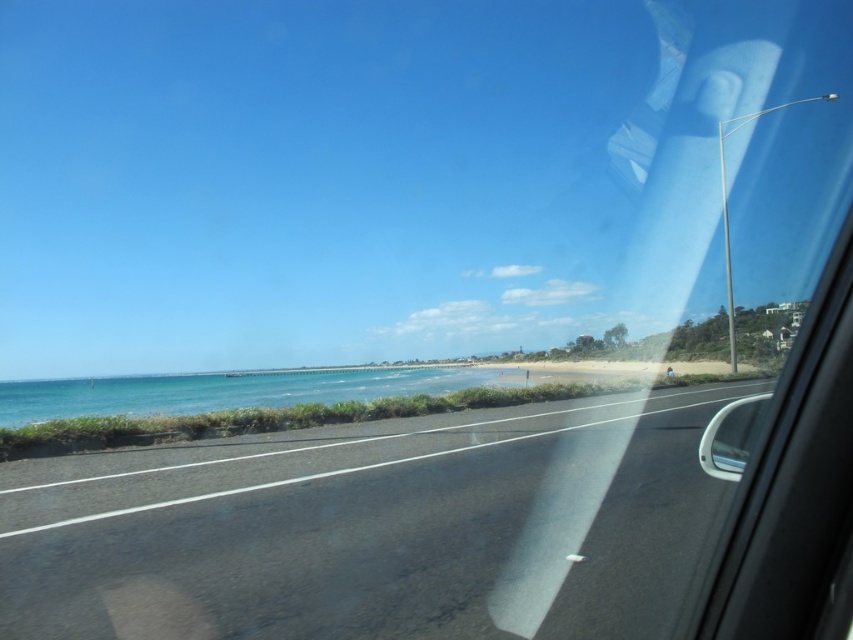
Which is in front, point (692, 394) or point (167, 397)?

Point (692, 394)

Can you confirm if black asphalt highway at center is smaller than blue water at lower left?

Yes, black asphalt highway at center is smaller than blue water at lower left.

I want to click on black asphalt highway at center, so click(373, 531).

Find the location of a particular element. The image size is (853, 640). black asphalt highway at center is located at coordinates (373, 531).